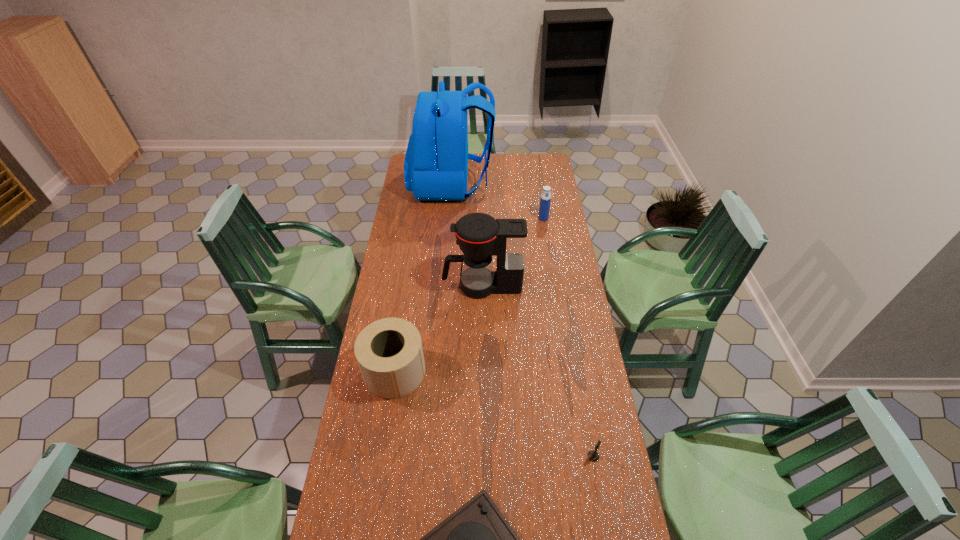
This screenshot has height=540, width=960. I want to click on vacant position located pour from the carafe of the coffee maker, so click(x=419, y=286).

What are the coordinates of `vacant space located 0.130m pour from the carafe of the coffee maker` in the screenshot? It's located at click(414, 286).

Find the location of a particular element. This screenshot has width=960, height=540. free space located 0.170m on the front of the fifth nearest object is located at coordinates (547, 242).

The height and width of the screenshot is (540, 960). What are the coordinates of `vacant space located on the front of the toilet tissue` in the screenshot? It's located at (372, 517).

The height and width of the screenshot is (540, 960). I want to click on free region located on the back of the second nearest object, so click(x=579, y=374).

The image size is (960, 540). I want to click on object located at the far edge, so click(436, 162).

Identify the location of backpack that is at the left edge. (436, 162).

What are the coordinates of `toilet tissue at the left edge` in the screenshot? It's located at (389, 352).

Identify the location of water bottle that is at the right edge. (545, 200).

Where is `candle located in the right edge section of the desktop`? candle located in the right edge section of the desktop is located at coordinates (593, 456).